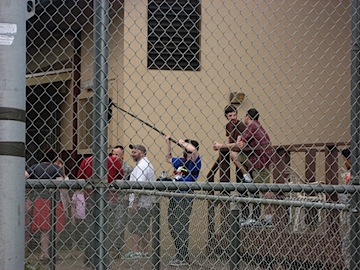
At what (x,y) coordinates should I click in order to perform the action: click on dark wooden platform. Please return your answer as a coordinate pair (x, y). The width and height of the screenshot is (360, 270). Looking at the image, I should click on (302, 242).